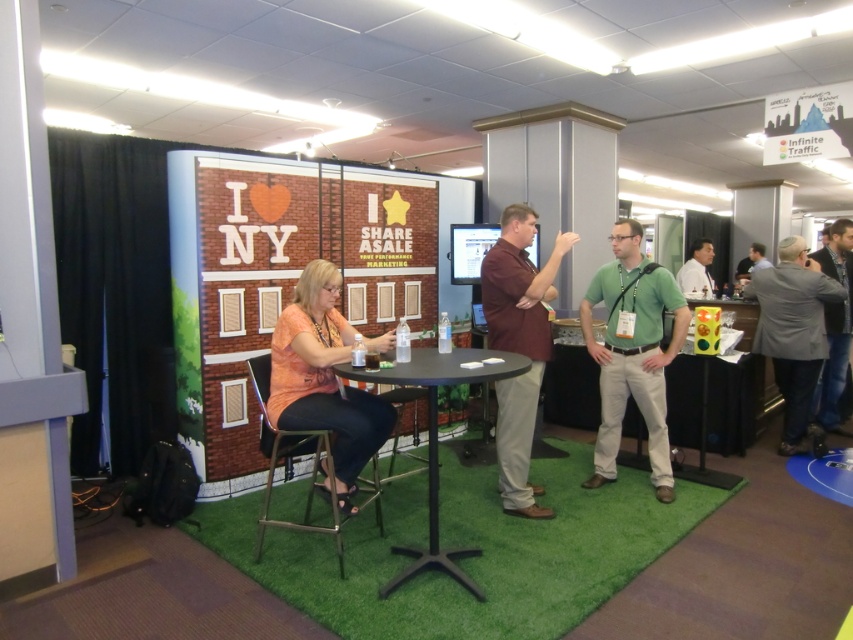
Question: Does gray fabric jacket at lower right have a larger size compared to black plastic table at center?

Choices:
 (A) no
 (B) yes

Answer: (B)

Question: Which point appears closest to the camera in this image?

Choices:
 (A) (671, 280)
 (B) (393, 234)
 (C) (764, 278)

Answer: (A)

Question: Which point is farther from the camera taking this photo?

Choices:
 (A) (645, 332)
 (B) (489, 314)

Answer: (A)

Question: Which object appears farthest from the camera in this image?

Choices:
 (A) gray fabric jacket at lower right
 (B) gray fabric jacket at right
 (C) white shirt at center
 (D) black plastic table at center

Answer: (C)

Question: Is brick-patterned board at center closer to camera compared to matte black shirt at upper right?

Choices:
 (A) no
 (B) yes

Answer: (B)

Question: Observing the image, what is the correct spatial positioning of brick-patterned board at center in reference to white shirt at center?

Choices:
 (A) left
 (B) right

Answer: (A)